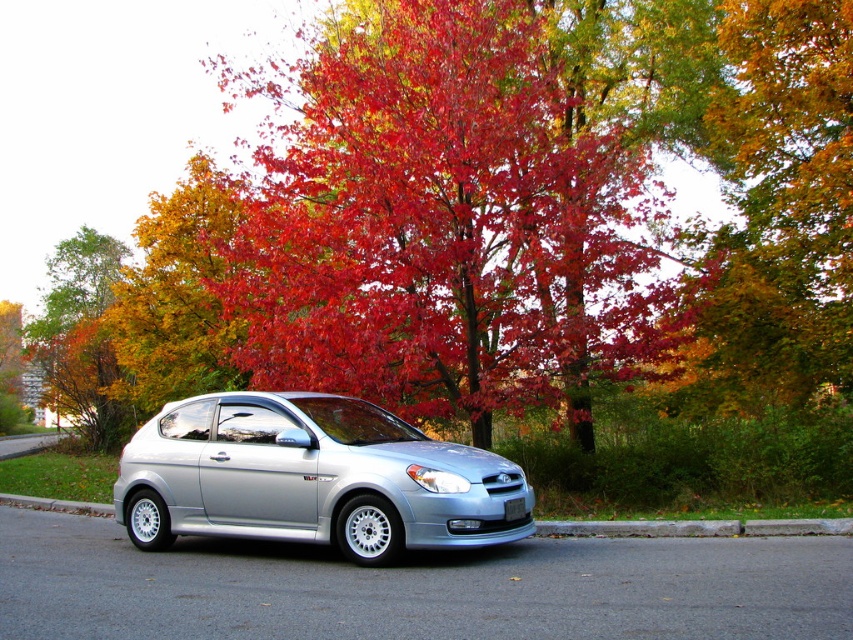
Which of these two, gray concrete curb at lower center or white plastic license plate at center, stands taller?

gray concrete curb at lower center is taller.

Can you confirm if gray concrete curb at lower center is thinner than white plastic license plate at center?

No.

Find the location of `gray concrete curb at lower center`. gray concrete curb at lower center is located at coordinates (695, 528).

Which is in front, point (479, 528) or point (239, 374)?

Point (479, 528)

Locate an element on the screen. This screenshot has width=853, height=640. satin silver car at center is located at coordinates (310, 477).

Where is `satin silver car at center`? This screenshot has height=640, width=853. satin silver car at center is located at coordinates (310, 477).

Find the location of a particular element. The image size is (853, 640). satin silver car at center is located at coordinates (310, 477).

Can you confirm if satin silver car at center is positioned to the right of white plastic license plate at center?

Incorrect, satin silver car at center is not on the right side of white plastic license plate at center.

Between satin silver car at center and white plastic license plate at center, which one appears on the right side from the viewer's perspective?

white plastic license plate at center

This screenshot has width=853, height=640. What are the coordinates of `satin silver car at center` in the screenshot? It's located at 310,477.